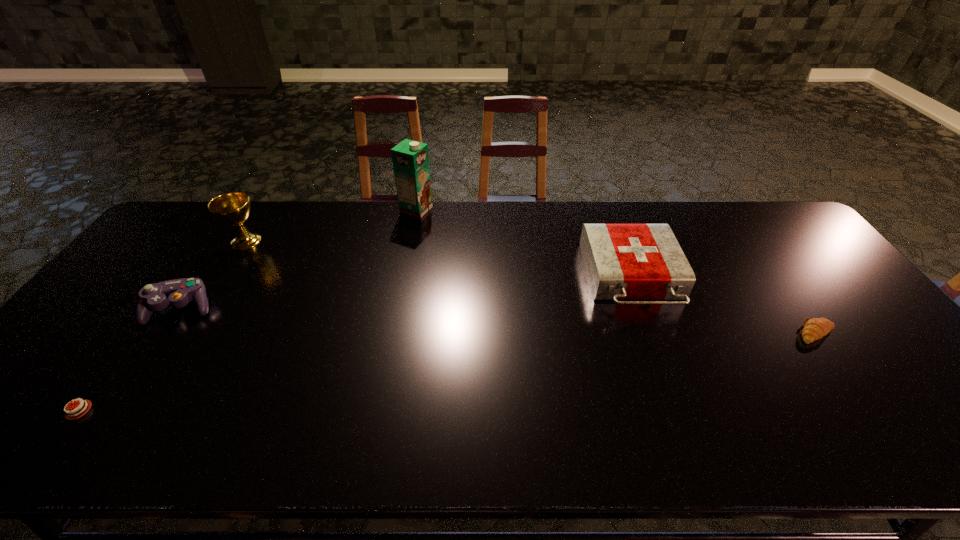
Identify the location of chocolate cake present at the left edge. This screenshot has width=960, height=540. (70, 415).

Where is `object that is positioned at the right edge`? This screenshot has height=540, width=960. object that is positioned at the right edge is located at coordinates (814, 329).

Find the location of `object situated at the near left corner`. object situated at the near left corner is located at coordinates (70, 415).

Image resolution: width=960 pixels, height=540 pixels. I want to click on vacant region at the far edge, so click(x=468, y=204).

Identify the location of blank space at the near edge. (684, 450).

Locate an element on the screen. The image size is (960, 540). vacant region at the right edge of the desktop is located at coordinates (765, 246).

At what (x,y) coordinates should I click in order to perform the action: click on free space at the near right corner. Please return your answer as a coordinate pair (x, y). Image resolution: width=960 pixels, height=540 pixels. Looking at the image, I should click on (907, 421).

The width and height of the screenshot is (960, 540). What are the coordinates of `free area in between the shortest object and the control` in the screenshot? It's located at (130, 360).

The image size is (960, 540). Find the location of `vacant area between the farthest object and the nearest object`. vacant area between the farthest object and the nearest object is located at coordinates (248, 310).

The image size is (960, 540). I want to click on free point between the crescent roll and the chalice, so click(532, 287).